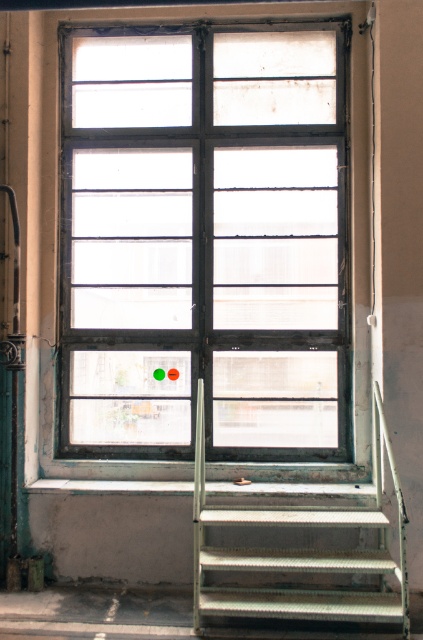
Which is behind, point (241, 292) or point (386, 440)?

Point (241, 292)

Image resolution: width=423 pixels, height=640 pixels. What are the coordinates of `matte glass window at center` in the screenshot? It's located at (203, 241).

This screenshot has width=423, height=640. I want to click on matte glass window at center, so click(203, 241).